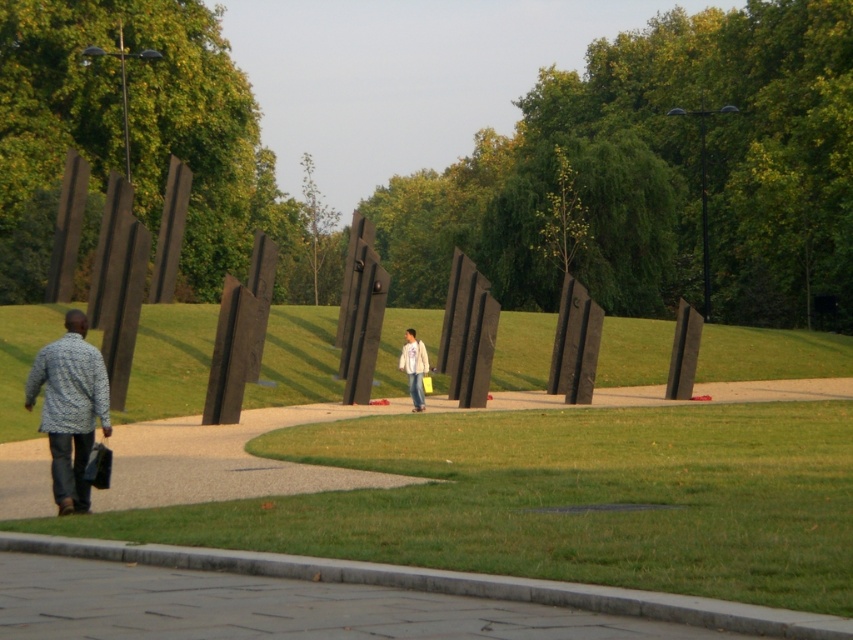
Question: Considering the real-world distances, which object is closest to the patterned fabric shirt at lower left?

Choices:
 (A) dark brown wood at left
 (B) white cotton jacket at center

Answer: (B)

Question: Does dark brown wood at left have a smaller size compared to white cotton jacket at center?

Choices:
 (A) no
 (B) yes

Answer: (A)

Question: Is dark brown wood at left below white cotton jacket at center?

Choices:
 (A) yes
 (B) no

Answer: (B)

Question: Which point is farther from the camera taking this photo?

Choices:
 (A) (207, 182)
 (B) (41, 170)
 (C) (45, 356)
 (D) (403, 365)

Answer: (A)

Question: Which of the following is the closest to the observer?

Choices:
 (A) patterned fabric shirt at lower left
 (B) white cotton jacket at center

Answer: (A)

Question: Can you confirm if green leafy tree at center is thinner than patterned fabric shirt at lower left?

Choices:
 (A) no
 (B) yes

Answer: (A)